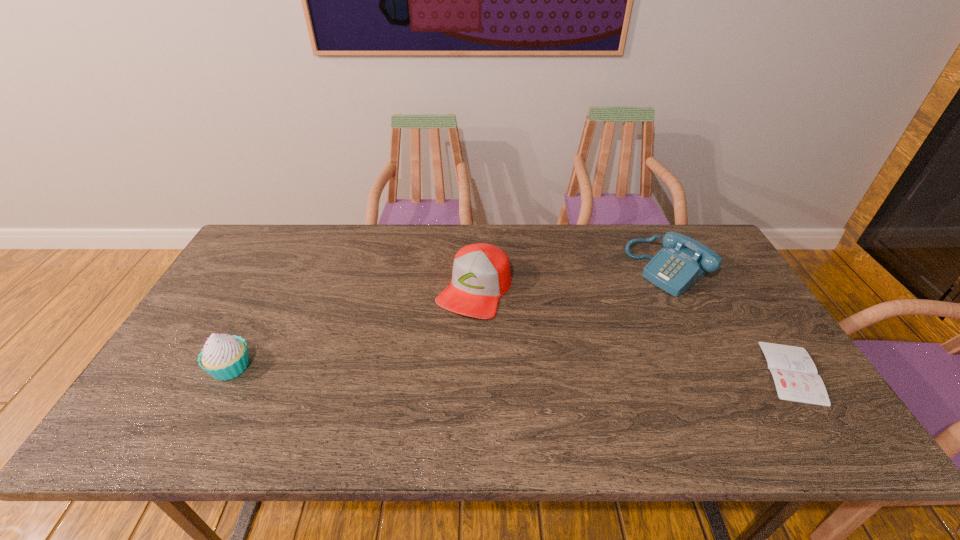
This screenshot has height=540, width=960. I want to click on cupcake, so click(224, 357).

Where is `diary`? Image resolution: width=960 pixels, height=540 pixels. diary is located at coordinates (795, 375).

Find the location of `telephone`. telephone is located at coordinates (683, 261).

Identify the location of the third object from right to left. (481, 274).

Locate an element on the screen. This screenshot has width=960, height=540. free space located on the back of the cupcake is located at coordinates 287,261.

Where is `free spot located 0.290m on the left of the shortest object`? The width and height of the screenshot is (960, 540). free spot located 0.290m on the left of the shortest object is located at coordinates (647, 372).

At what (x,y) coordinates should I click in order to perform the action: click on vacant space located on the dial of the telephone. Please return your answer as a coordinate pair (x, y). This screenshot has width=960, height=540. Looking at the image, I should click on (612, 309).

At what (x,y) coordinates should I click in order to perform the action: click on free location located on the dial of the telephone. Please return your answer as a coordinate pair (x, y). Looking at the image, I should click on (558, 346).

Locate an element on the screen. The width and height of the screenshot is (960, 540). vacant space located on the dial of the telephone is located at coordinates (555, 347).

At what (x,y) coordinates should I click in order to perform the action: click on free space located on the front-facing side of the baseball cap. Please return your answer as a coordinate pair (x, y). Looking at the image, I should click on (419, 386).